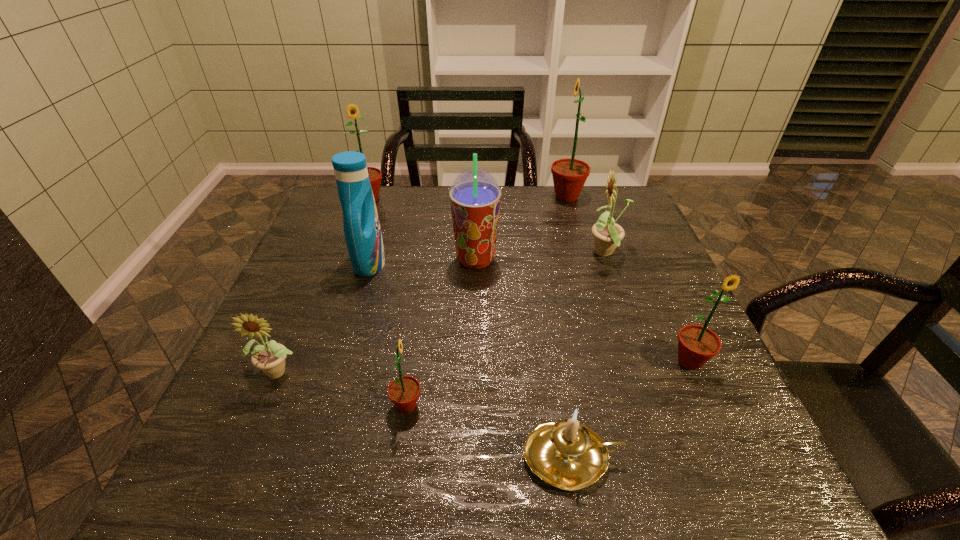
Identify the location of the tallest object. This screenshot has width=960, height=540. (569, 175).

In order to click on the tallest sunflower in this screenshot , I will do `click(569, 175)`.

This screenshot has width=960, height=540. In order to click on the third smallest green sunflower in this screenshot , I will do `click(352, 111)`.

Where is `the second tallest sunflower`? The width and height of the screenshot is (960, 540). the second tallest sunflower is located at coordinates (352, 111).

Where is `the fifth object from left to right`? the fifth object from left to right is located at coordinates (475, 196).

At what (x,y) coordinates should I click in order to perform the action: click on detergent. Please return your answer as a coordinate pair (x, y). The height and width of the screenshot is (540, 960). Looking at the image, I should click on (362, 231).

What are the coordinates of `the right yellow sunflower` in the screenshot? It's located at (608, 234).

The image size is (960, 540). Find the location of `the fourth nearest sunflower`. the fourth nearest sunflower is located at coordinates (608, 234).

Image resolution: width=960 pixels, height=540 pixels. In order to click on the second smallest green sunflower in this screenshot , I will do `click(697, 344)`.

Identify the location of the second nearest green sunflower. Image resolution: width=960 pixels, height=540 pixels. (697, 344).